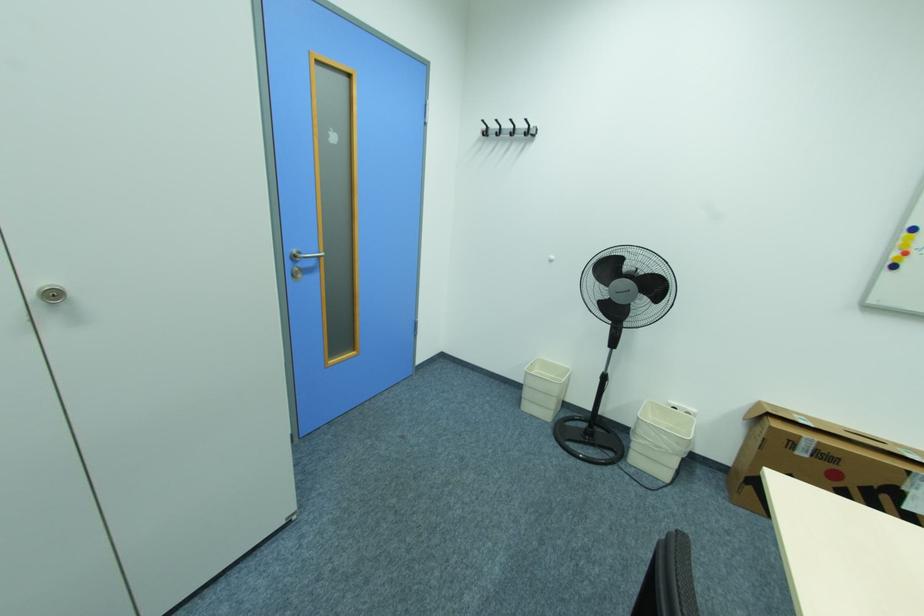
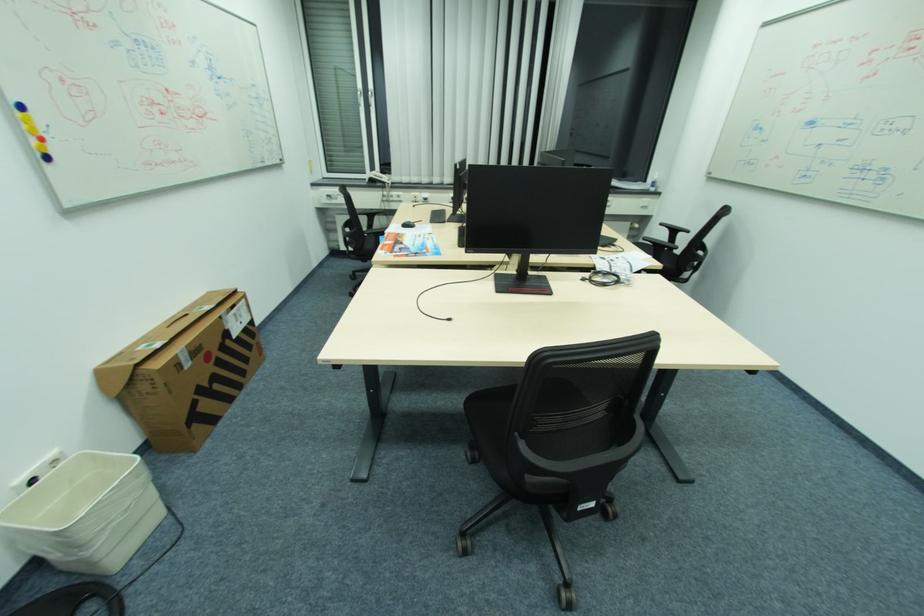
Find the pixel in the second image that matches (683,444) in the first image.

(143, 476)